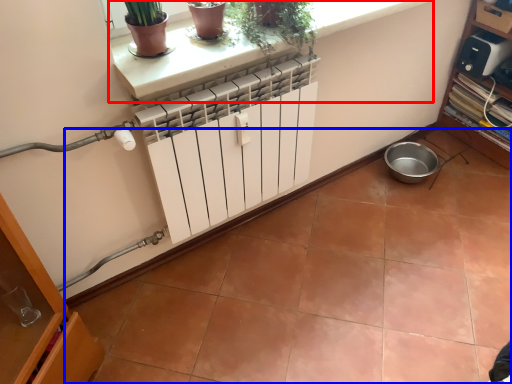
Question: Which object is further to the camera taking this photo, ledge (highlighted by a red box) or ceramic tile (highlighted by a blue box)?

Choices:
 (A) ledge
 (B) ceramic tile

Answer: (A)